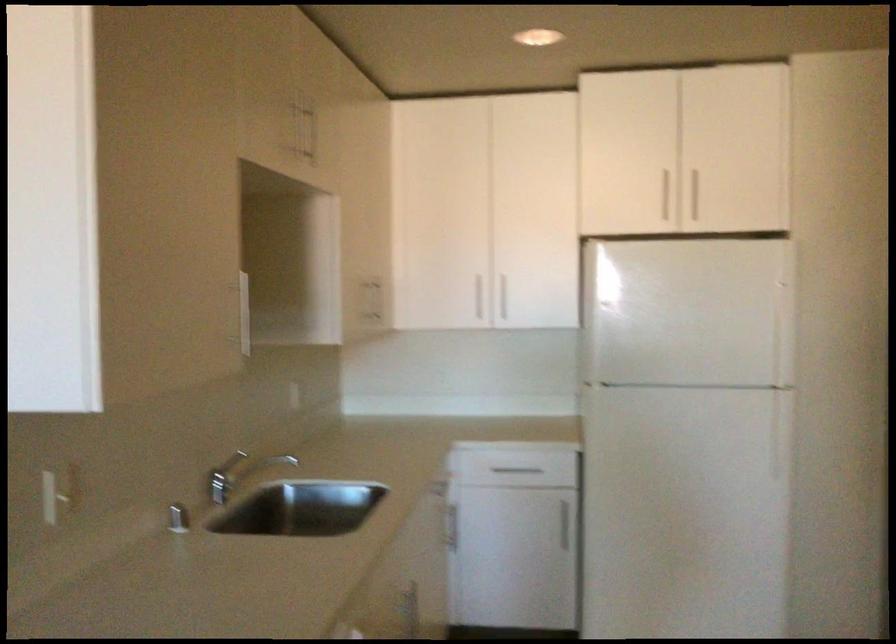
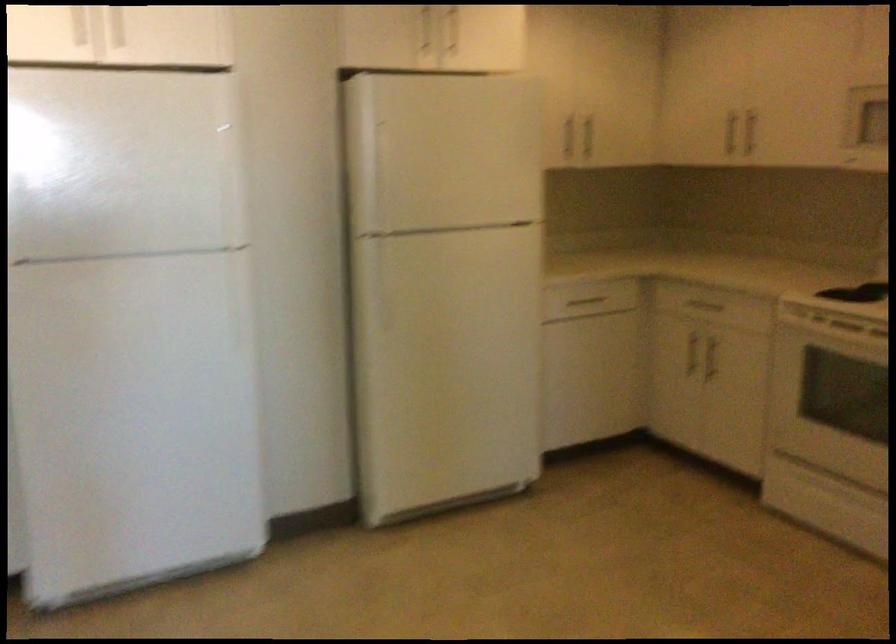
Question: Based on the continuous images, in which direction is the camera rotating? Reply with the corresponding letter.

Choices:
 (A) Left
 (B) Right
 (C) Up
 (D) Down

Answer: (B)